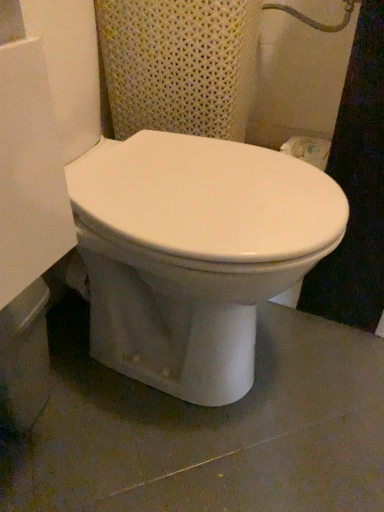
The height and width of the screenshot is (512, 384). Describe the element at coordinates (179, 64) in the screenshot. I see `white textured fabric at upper center` at that location.

Find the location of a particular element. The image size is (384, 512). white textured fabric at upper center is located at coordinates (179, 64).

Locate an element on the screen. This screenshot has height=512, width=384. white textured fabric at upper center is located at coordinates (179, 64).